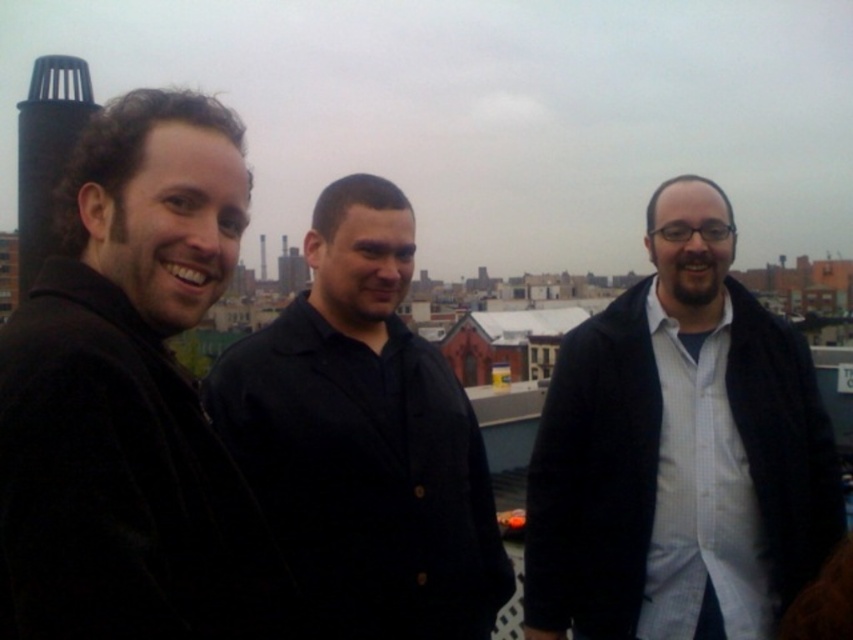
Question: Which point is closer to the camera taking this photo?

Choices:
 (A) (718, 518)
 (B) (213, 152)
 (C) (363, 452)

Answer: (B)

Question: Which object is positioned closest to the black velvet jacket at left?

Choices:
 (A) black matte shirt at center
 (B) white matte jacket at center

Answer: (A)

Question: Does black velvet jacket at left have a smaller size compared to white matte jacket at center?

Choices:
 (A) yes
 (B) no

Answer: (B)

Question: Is black velvet jacket at left in front of white matte jacket at center?

Choices:
 (A) no
 (B) yes

Answer: (B)

Question: Considering the real-world distances, which object is farthest from the black velvet jacket at left?

Choices:
 (A) white matte jacket at center
 (B) black matte shirt at center

Answer: (A)

Question: Is white matte jacket at center positioned before black matte shirt at center?

Choices:
 (A) no
 (B) yes

Answer: (B)